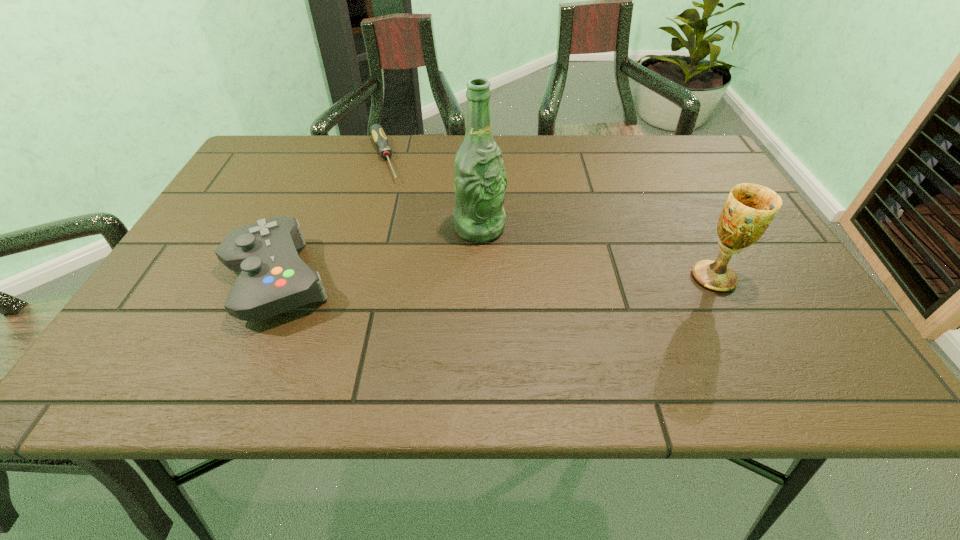
You are a GUI agent. You are given a task and a screenshot of the screen. Output one action in this format:
    pyautogui.click(x=<x>, y=<y>)
    Task: Click on the blank space at the far edge of the desktop
    The image size is (960, 540).
    Given the screenshot: What is the action you would take?
    pyautogui.click(x=642, y=137)

Where is `vacant space at the near edge of the desktop`? The image size is (960, 540). vacant space at the near edge of the desktop is located at coordinates (721, 308).

In the image, there is a desktop. Where is `vacant space at the far right corner`? Image resolution: width=960 pixels, height=540 pixels. vacant space at the far right corner is located at coordinates (709, 172).

Where is `vacant space that is in between the farthest object and the beer bottle`? Image resolution: width=960 pixels, height=540 pixels. vacant space that is in between the farthest object and the beer bottle is located at coordinates (432, 193).

Locate an element on the screen. This screenshot has width=960, height=540. empty space that is in between the second tallest object and the screwdriver is located at coordinates point(549,218).

This screenshot has width=960, height=540. In order to click on blank region between the second tallest object and the screwdriver in this screenshot , I will do `click(549, 218)`.

The height and width of the screenshot is (540, 960). I want to click on unoccupied area between the shortest object and the second shortest object, so click(330, 219).

Locate an element on the screen. Image resolution: width=960 pixels, height=540 pixels. free space between the tallest object and the rightmost object is located at coordinates (596, 253).

Where is `free spot between the control and the third shortest object`? The height and width of the screenshot is (540, 960). free spot between the control and the third shortest object is located at coordinates (495, 279).

Identify the location of free space that is in between the third tallest object and the tallest object. (378, 254).